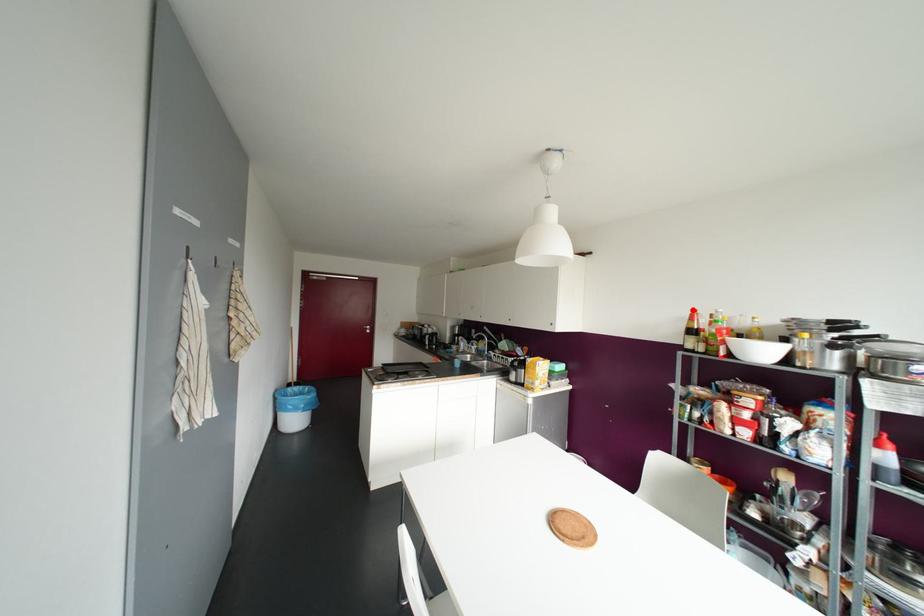
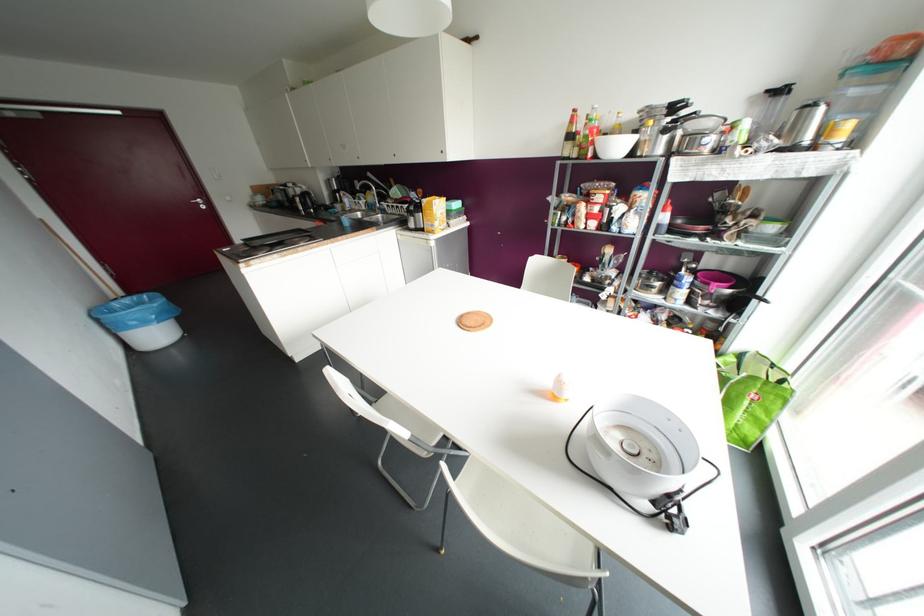
Question: I am providing you with two images of the same scene from different viewpoints. A red point is marked on the first image. Can you still see the location of the red point in image 2?

Choices:
 (A) Yes
 (B) No

Answer: (A)